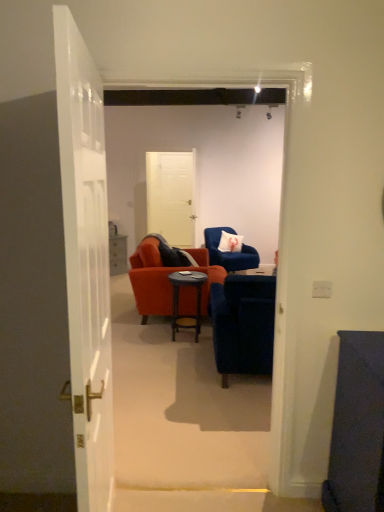
Question: Does velvet blue armchair at center, which appears as the 1th chair when viewed from the front, have a lesser height compared to white fabric pillow at center?

Choices:
 (A) yes
 (B) no

Answer: (B)

Question: Is velvet blue armchair at center, the second chair viewed from the back, completely or partially outside of white fabric pillow at center?

Choices:
 (A) yes
 (B) no

Answer: (A)

Question: Is velvet blue armchair at center, the second chair viewed from the back, aimed at white fabric pillow at center?

Choices:
 (A) yes
 (B) no

Answer: (A)

Question: Is velvet blue armchair at center, which appears as the 1th chair when viewed from the front, oriented away from white fabric pillow at center?

Choices:
 (A) yes
 (B) no

Answer: (B)

Question: From a real-world perspective, is velvet blue armchair at center, which appears as the 1th chair when viewed from the front, on white fabric pillow at center?

Choices:
 (A) yes
 (B) no

Answer: (B)

Question: Is velvet blue armchair at center, the second chair viewed from the back, positioned far away from white fabric pillow at center?

Choices:
 (A) no
 (B) yes

Answer: (B)

Question: From a real-world perspective, is white fabric pillow at center positioned under white glossy door at left, marked as the first door in a front-to-back arrangement, based on gravity?

Choices:
 (A) no
 (B) yes

Answer: (B)

Question: Are white fabric pillow at center and white glossy door at left, the 1th door from the bottom, far apart?

Choices:
 (A) yes
 (B) no

Answer: (A)

Question: Can you see white fabric pillow at center touching white glossy door at left, the 1th door from the bottom?

Choices:
 (A) no
 (B) yes

Answer: (A)

Question: From the image's perspective, is white fabric pillow at center below white glossy door at left, marked as the first door in a front-to-back arrangement?

Choices:
 (A) no
 (B) yes

Answer: (A)

Question: Is the depth of white fabric pillow at center greater than that of white glossy door at left, arranged as the 2th door when viewed from the back?

Choices:
 (A) yes
 (B) no

Answer: (A)

Question: Does white fabric pillow at center appear on the left side of white glossy door at left, the 2th door viewed from the top?

Choices:
 (A) no
 (B) yes

Answer: (A)

Question: Is dark wood side table at center inside white matte door at center, which appears as the second door when viewed from the front?

Choices:
 (A) no
 (B) yes

Answer: (A)